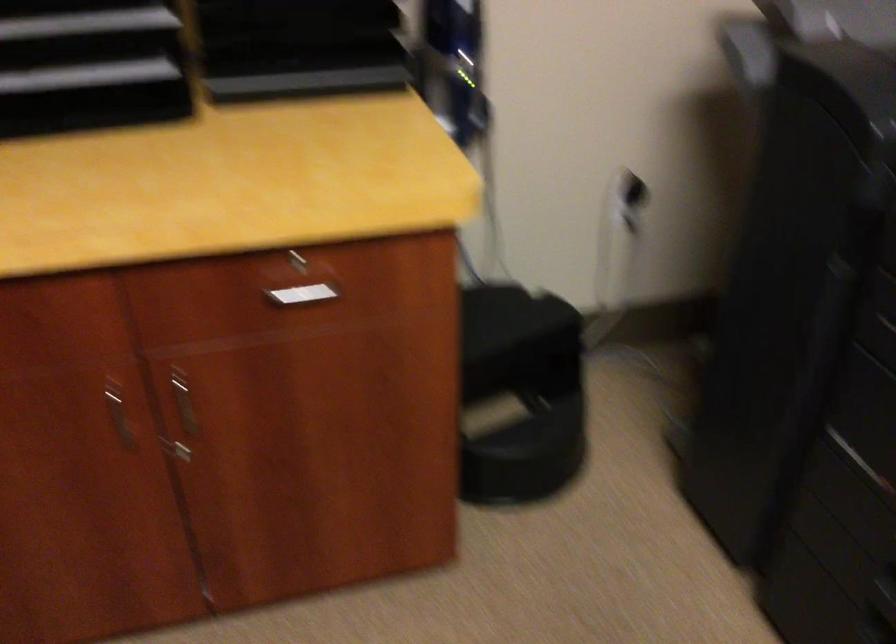
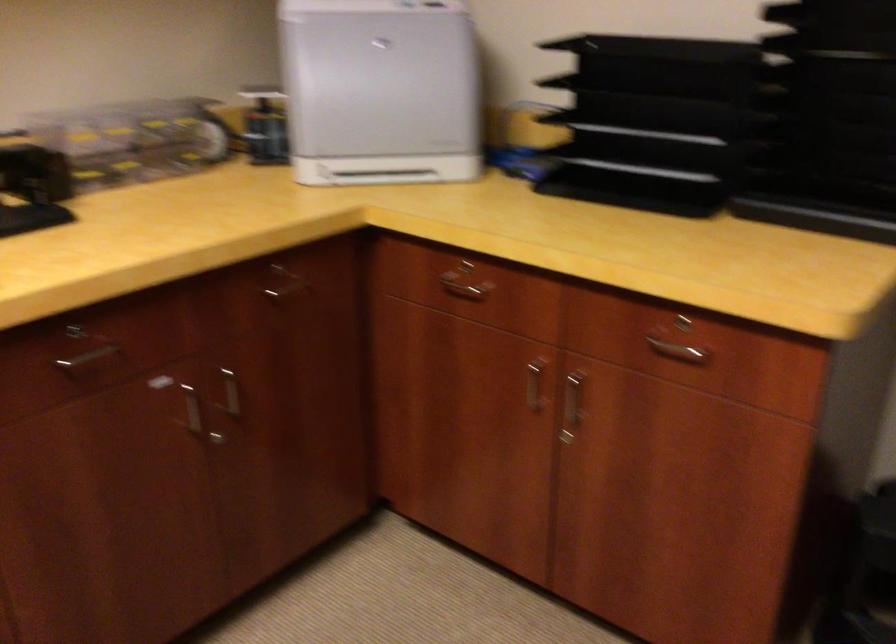
Question: The camera is either moving clockwise (left) or counter-clockwise (right) around the object. The first image is from the beginning of the video and the second image is from the end. Is the camera moving left or right when shooting the video?

Choices:
 (A) Left
 (B) Right

Answer: (B)